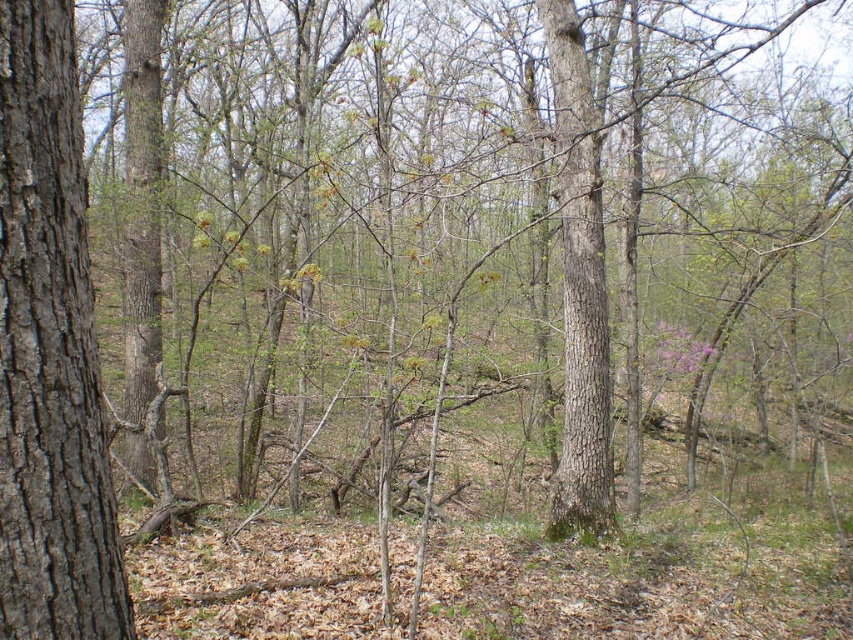
Question: Which object appears closest to the camera in this image?

Choices:
 (A) gray rough bark tree trunk at left
 (B) smooth brown tree trunk at center

Answer: (A)

Question: Does gray rough bark tree trunk at left appear on the left side of smooth brown tree trunk at center?

Choices:
 (A) no
 (B) yes

Answer: (B)

Question: Does gray rough bark tree trunk at left come behind smooth brown tree trunk at center?

Choices:
 (A) yes
 (B) no

Answer: (B)

Question: Does gray rough bark tree trunk at left have a smaller size compared to smooth brown tree trunk at center?

Choices:
 (A) yes
 (B) no

Answer: (A)

Question: Which object appears closest to the camera in this image?

Choices:
 (A) smooth brown tree trunk at center
 (B) gray rough bark tree trunk at left

Answer: (B)